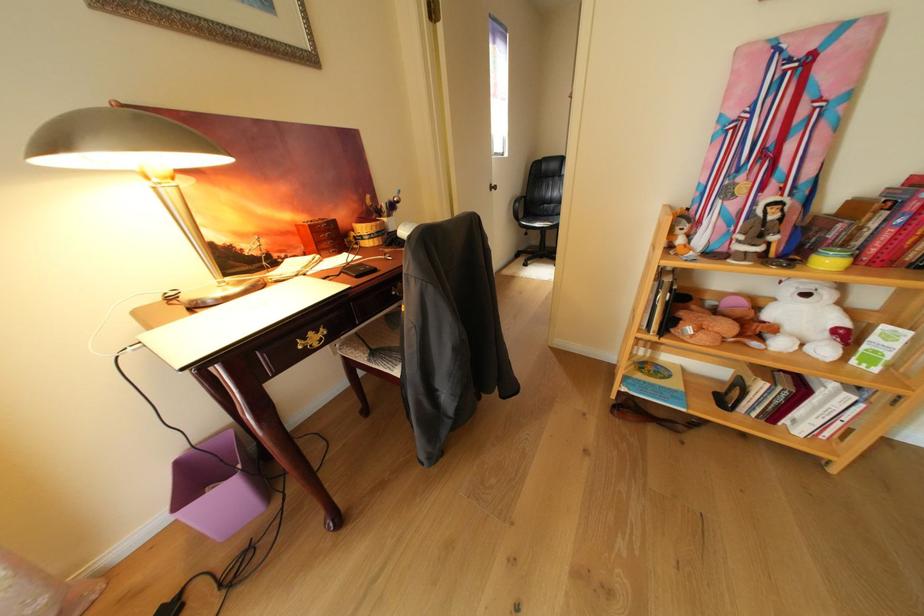
The location [681,235] corresponds to which object?

It refers to a orange stuffed animal.